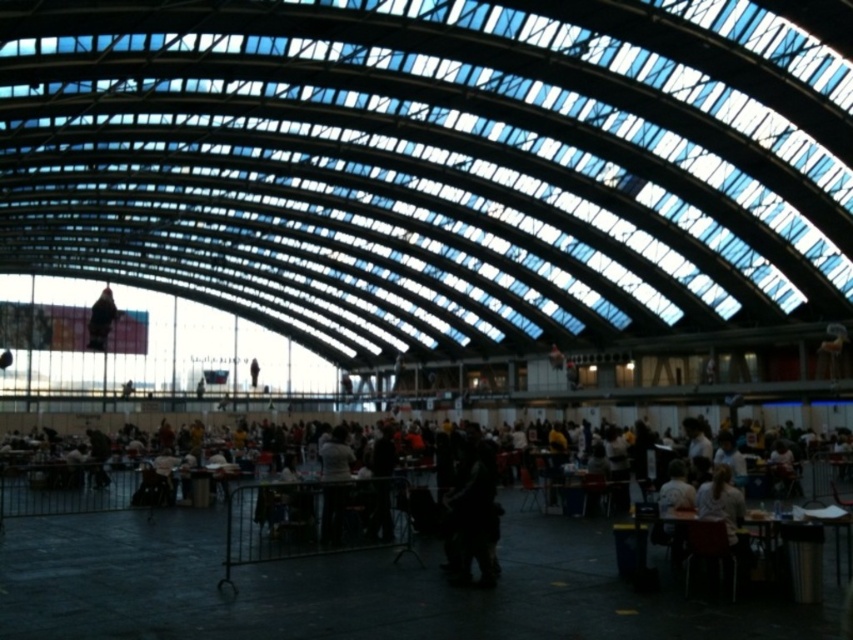
Question: Can you confirm if dark gray jacket at center is smaller than dark fabric bag at center?

Choices:
 (A) yes
 (B) no

Answer: (B)

Question: Which point is closer to the camera taking this photo?

Choices:
 (A) (846, 563)
 (B) (688, 512)

Answer: (B)

Question: In this image, where is dark gray jacket at center located relative to dark fabric bag at center?

Choices:
 (A) right
 (B) left

Answer: (B)

Question: Which point appears farthest from the camera in this image?

Choices:
 (A) (225, 493)
 (B) (674, 509)
 (C) (479, 564)

Answer: (A)

Question: Can you confirm if dark gray jacket at center is positioned above wooden table at lower right?

Choices:
 (A) no
 (B) yes

Answer: (A)

Question: Estimate the real-world distances between objects in this image. Which object is closer to the wooden table at lower right?

Choices:
 (A) dark gray jacket at center
 (B) dark fabric bag at center

Answer: (B)